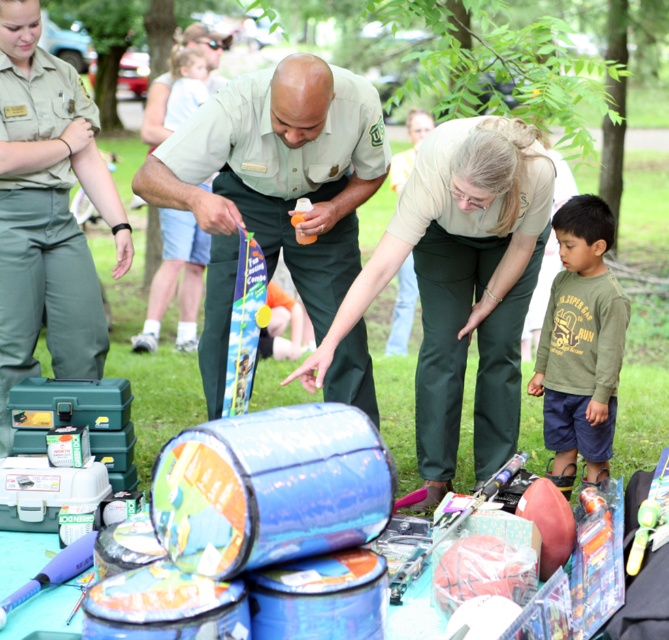
Does green uniform at center have a lesser width compared to translucent plastic bottle at center?

No.

Can you confirm if green uniform at center is wider than translucent plastic bottle at center?

Yes.

Measure the distance between point (353, 214) and camera.

The distance of point (353, 214) from camera is 13.34 feet.

You are a GUI agent. You are given a task and a screenshot of the screen. Output one action in this format:
    pyautogui.click(x=<x>, y=<y>)
    Task: Click on the green uniform at center
    This screenshot has height=640, width=669.
    Given the screenshot: What is the action you would take?
    pyautogui.click(x=274, y=186)

Who is lower down, green uniform at center or matte green pants at center?

matte green pants at center is lower down.

Between point (341, 195) and point (359, 285), which one is positioned behind?

The point (341, 195) is behind.

Between point (195, 125) and point (477, 413), which one is positioned behind?

The point (477, 413) is behind.

Image resolution: width=669 pixels, height=640 pixels. Find the location of `green uniform at center`. green uniform at center is located at coordinates (274, 186).

Is point (551, 308) more distant than point (294, 218)?

That is True.

Between green cotton shirt at lower right and translucent plastic bottle at center, which one has less height?

Standing shorter between the two is translucent plastic bottle at center.

Image resolution: width=669 pixels, height=640 pixels. Find the location of `green cotton shirt at lower right`. green cotton shirt at lower right is located at coordinates (581, 340).